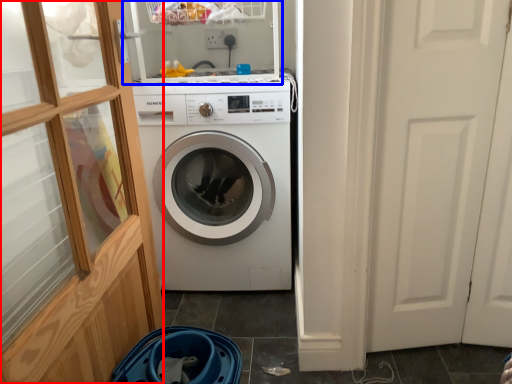
Question: Which object appears farthest to the camera in this image, glass door (highlighted by a red box) or shelf (highlighted by a blue box)?

Choices:
 (A) glass door
 (B) shelf

Answer: (B)